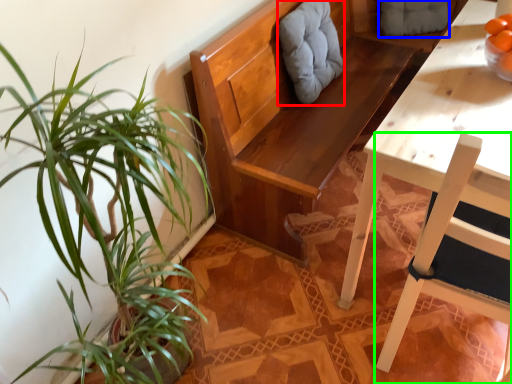
Question: Based on their relative distances, which object is nearer to swivel chair (highlighted by a red box)? Choose from swivel chair (highlighted by a blue box) and chair (highlighted by a green box).

Choices:
 (A) swivel chair
 (B) chair

Answer: (A)